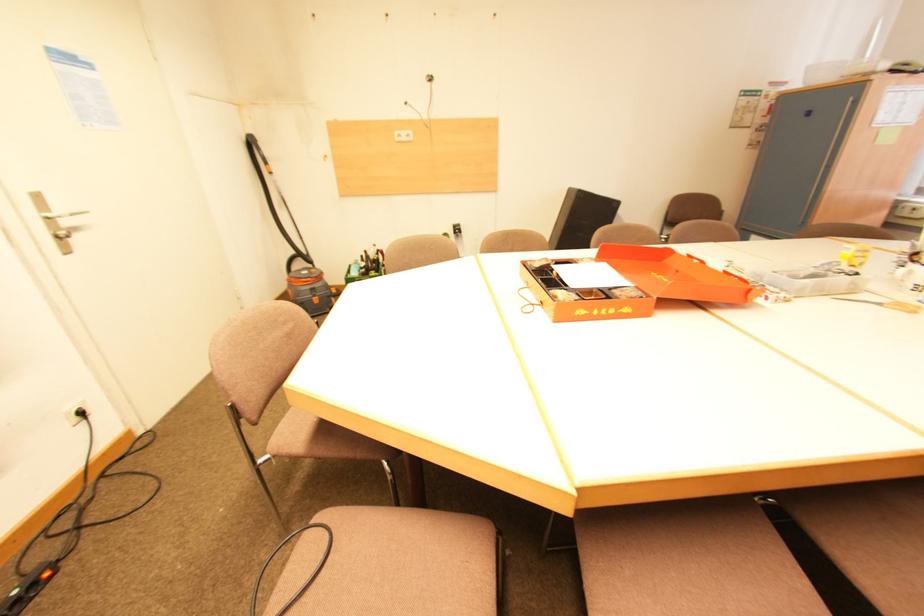
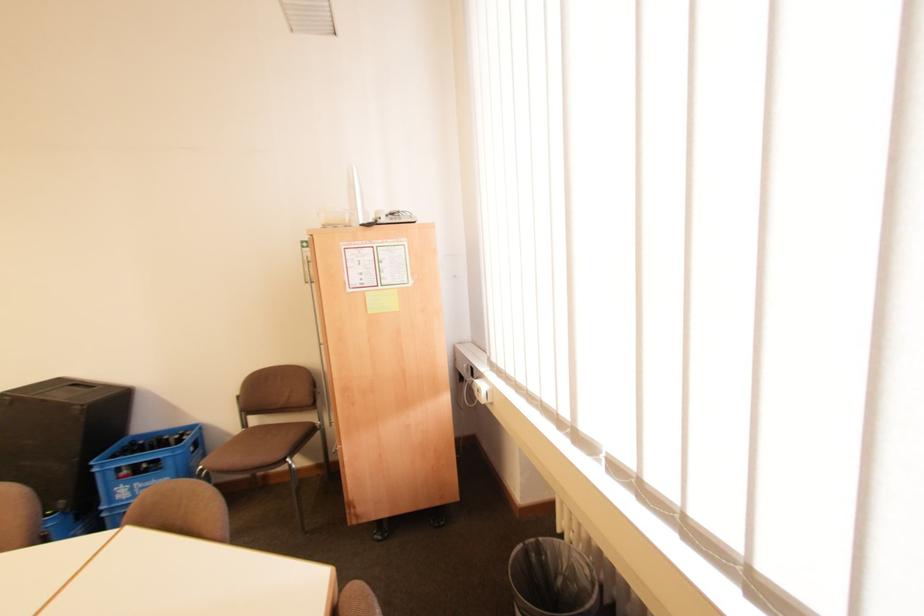
Question: Which direction would the cameraman need to move to produce the second image? Reply with the corresponding letter.

Choices:
 (A) Left
 (B) Right
 (C) Forward
 (D) Backward

Answer: (B)